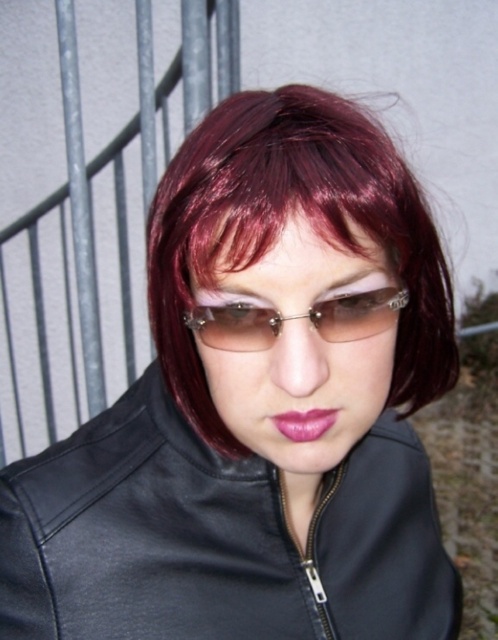
You are a makeup artist observing the person in the image. You need to apply a new lip color that matches the existing bold makeup. Considering the shiny burgundy wig at center and the pink glossy lips at center, which object is taller?

The shiny burgundy wig at center is taller than the pink glossy lips at center.

You are taking a photo of the person in the image. You want to focus on the point closer to the camera between the two points, point (334, 328) and point (275, 419). Which point should you focus on?

You should focus on point (334, 328) because it is closer to the camera than point (275, 419).

You are a makeup artist trying to apply lipstick to a client. The client has clear plastic glasses at center and pink glossy lips at center. Can you apply lipstick without removing the glasses?

The clear plastic glasses at center are positioned over the pink glossy lips at center, so you cannot apply lipstick without removing the glasses first.